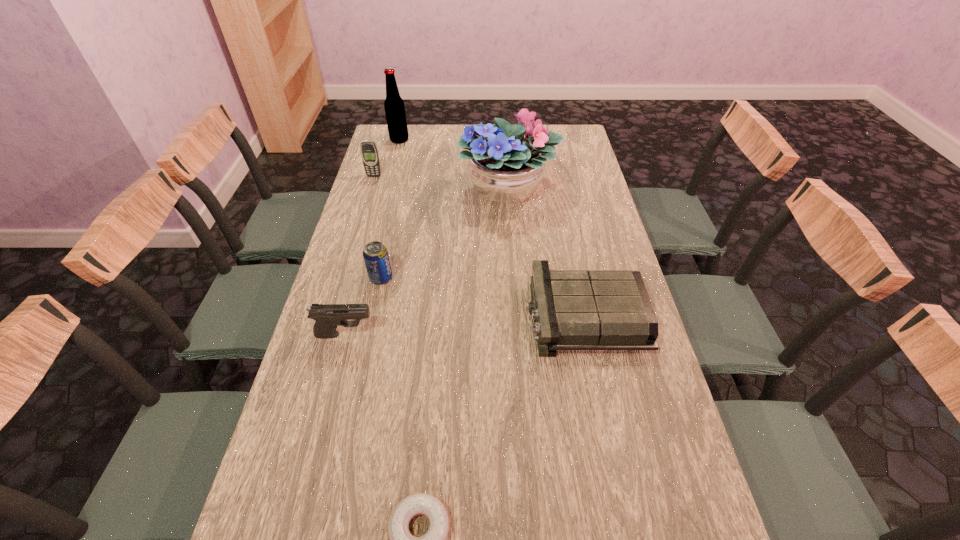
I want to click on the farthest object, so click(x=394, y=105).

Locate an element on the screen. Image resolution: width=960 pixels, height=540 pixels. bouquet is located at coordinates (x=505, y=167).

Locate an element on the screen. cellular telephone is located at coordinates (369, 152).

At what (x,y) coordinates should I click in order to perform the action: click on soda. Please return your answer as a coordinate pair (x, y). Looking at the image, I should click on (375, 254).

You are a GUI agent. You are given a task and a screenshot of the screen. Output one action in this format:
    pyautogui.click(x=<x>, y=<y>)
    Task: Click on the pistol
    The width and height of the screenshot is (960, 540).
    Given the screenshot: What is the action you would take?
    327,316

Identify the location of radio receiver. (573, 310).

Find the location of a particular element. vacant region located 0.200m on the front of the beer bottle is located at coordinates (392, 171).

What are the coordinates of `free space located on the back of the bouquet` in the screenshot? It's located at (505, 153).

I want to click on vacant space situated 0.200m on the screen of the cellular telephone, so click(364, 210).

The width and height of the screenshot is (960, 540). What are the coordinates of `free region located 0.280m on the right of the soda` in the screenshot? It's located at (487, 278).